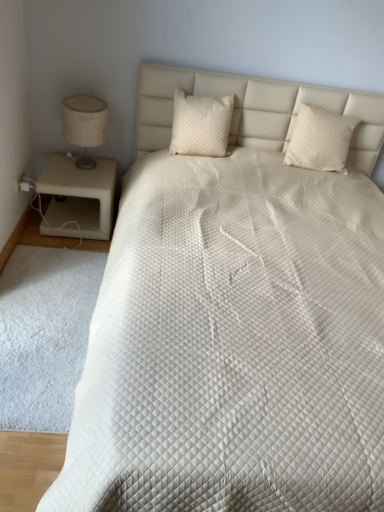
Question: From a real-world perspective, is white quilted pillow at center, marked as the 2th pillow in a left-to-right arrangement, physically above white fluffy rug at lower left?

Choices:
 (A) yes
 (B) no

Answer: (A)

Question: Does white quilted pillow at center, marked as the 2th pillow in a left-to-right arrangement, have a greater height compared to white fluffy rug at lower left?

Choices:
 (A) yes
 (B) no

Answer: (A)

Question: Can you confirm if white quilted pillow at center, which is the first pillow from right to left, is thinner than white fluffy rug at lower left?

Choices:
 (A) yes
 (B) no

Answer: (A)

Question: Is white quilted pillow at center, which is the first pillow from right to left, at the right side of white fluffy rug at lower left?

Choices:
 (A) yes
 (B) no

Answer: (A)

Question: Is white quilted pillow at center, which is the first pillow from right to left, at the left side of white fluffy rug at lower left?

Choices:
 (A) yes
 (B) no

Answer: (B)

Question: From the image's perspective, is white quilted pillow at center, marked as the 2th pillow in a left-to-right arrangement, located beneath white fluffy rug at lower left?

Choices:
 (A) no
 (B) yes

Answer: (A)

Question: Is white fluffy rug at lower left completely or partially outside of white quilted pillow at center, marked as the 2th pillow in a left-to-right arrangement?

Choices:
 (A) no
 (B) yes

Answer: (B)

Question: Is white fluffy rug at lower left shorter than white quilted pillow at center, which is the first pillow from right to left?

Choices:
 (A) no
 (B) yes

Answer: (B)

Question: Considering the relative positions of white fluffy rug at lower left and white quilted pillow at center, marked as the 2th pillow in a left-to-right arrangement, in the image provided, is white fluffy rug at lower left to the left of white quilted pillow at center, marked as the 2th pillow in a left-to-right arrangement, from the viewer's perspective?

Choices:
 (A) no
 (B) yes

Answer: (B)

Question: Could you tell me if white fluffy rug at lower left is turned towards white quilted pillow at center, marked as the 2th pillow in a left-to-right arrangement?

Choices:
 (A) no
 (B) yes

Answer: (A)

Question: Is white fluffy rug at lower left next to white quilted pillow at center, which is the first pillow from right to left, and touching it?

Choices:
 (A) no
 (B) yes

Answer: (A)

Question: From a real-world perspective, is white fluffy rug at lower left below white quilted pillow at center, marked as the 2th pillow in a left-to-right arrangement?

Choices:
 (A) yes
 (B) no

Answer: (A)

Question: Does white quilted pillow at center, which is the first pillow from right to left, have a larger size compared to beige matte nightstand at left?

Choices:
 (A) no
 (B) yes

Answer: (A)